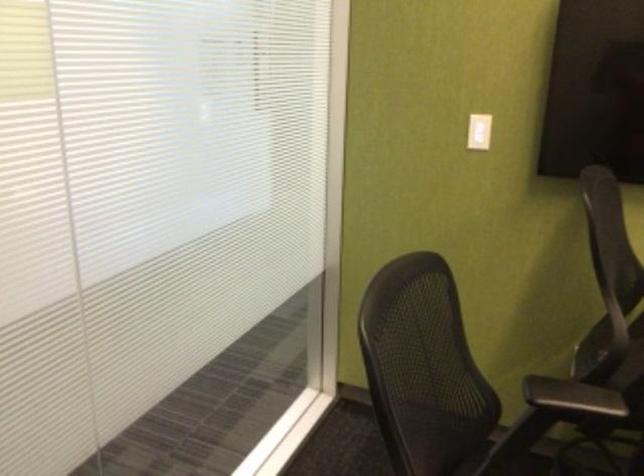
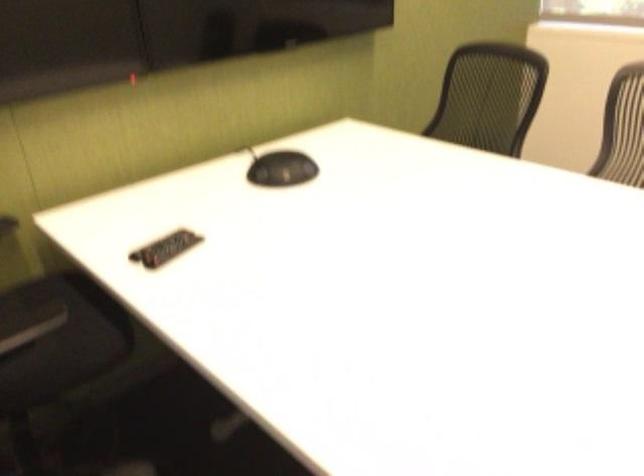
The images are taken continuously from a first-person perspective. In which direction is your viewpoint rotating?

The rotation direction of the camera is right-down.